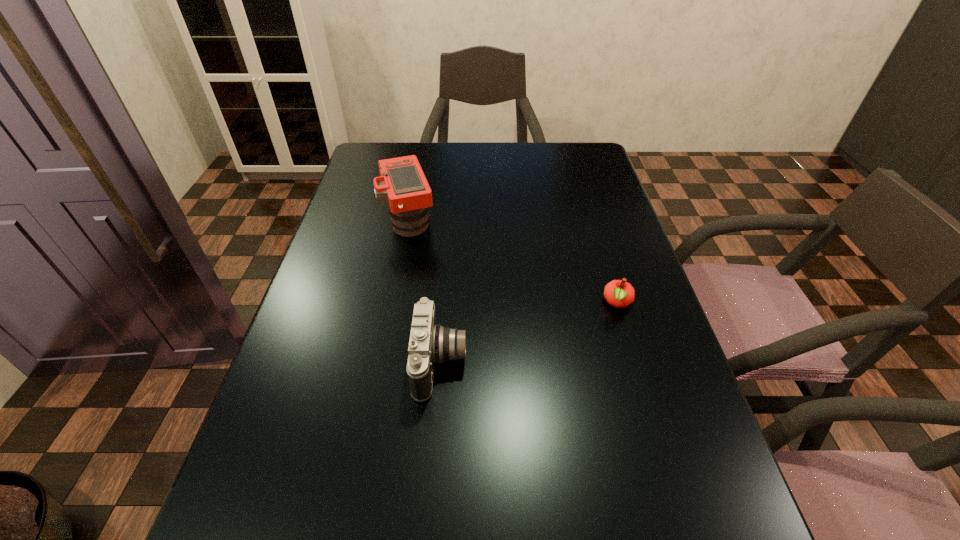
The height and width of the screenshot is (540, 960). I want to click on object that is at the right edge, so click(618, 293).

You are a GUI agent. You are given a task and a screenshot of the screen. Output one action in this format:
    pyautogui.click(x=<x>, y=<y>)
    Task: Click on the vacant space at the far edge
    The height and width of the screenshot is (540, 960).
    Given the screenshot: What is the action you would take?
    pyautogui.click(x=432, y=159)

The image size is (960, 540). I want to click on vacant position at the left edge of the desktop, so click(262, 444).

Where is `free space at the right edge`? This screenshot has width=960, height=540. free space at the right edge is located at coordinates (568, 222).

This screenshot has width=960, height=540. Find the location of `free space at the far right corner`. free space at the far right corner is located at coordinates (587, 152).

I want to click on vacant point located between the second tallest object and the rightmost object, so coord(529,333).

What are the coordinates of `vacant point located between the farthest object and the shortest object` in the screenshot? It's located at (514, 262).

The image size is (960, 540). Identify the location of free space between the farther camera and the shortest object. (514, 262).

You are a GUI agent. You are given a task and a screenshot of the screen. Output one action in this format:
    pyautogui.click(x=<x>, y=<y>)
    Task: Click on the free spot between the rightmost object and the nearest object
    This screenshot has height=540, width=960.
    Given the screenshot: What is the action you would take?
    pyautogui.click(x=529, y=333)

At what (x,y) coordinates should I click in order to perform the action: click on vacant area that lies between the farther camera and the second shortest object. Please return your answer as a coordinate pair (x, y). This screenshot has height=540, width=960. Looking at the image, I should click on (425, 292).